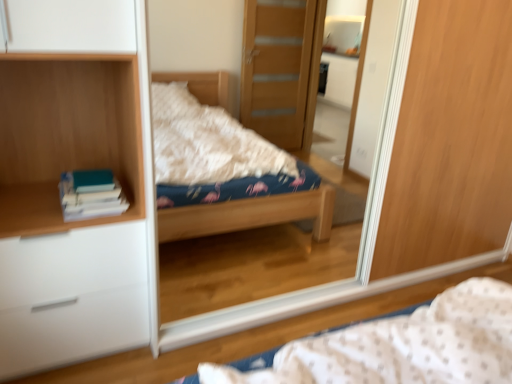
Question: From the image's perspective, is wooden bookshelf at left positioned above or below fluffy fabric bed at center?

Choices:
 (A) below
 (B) above

Answer: (B)

Question: Looking at their shapes, would you say wooden bookshelf at left is wider or thinner than fluffy fabric bed at center?

Choices:
 (A) thin
 (B) wide

Answer: (A)

Question: Which object is positioned farthest from the teal matte book at left?

Choices:
 (A) white matte chest of drawers at left
 (B) wooden bookshelf at left
 (C) wooden mirror at center
 (D) fluffy fabric bed at center

Answer: (C)

Question: Which is nearer to the wooden mirror at center?

Choices:
 (A) teal matte book at left
 (B) wooden bookshelf at left
 (C) fluffy fabric bed at center
 (D) white matte chest of drawers at left

Answer: (D)